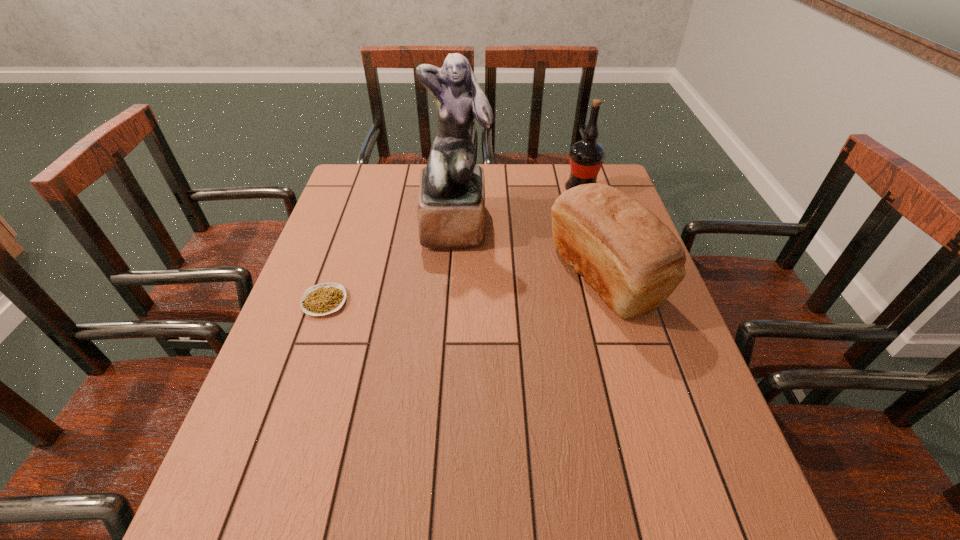
Image resolution: width=960 pixels, height=540 pixels. I want to click on vacant space at the right edge, so click(680, 485).

Locate an element on the screen. The width and height of the screenshot is (960, 540). free space at the far left corner is located at coordinates (368, 203).

The height and width of the screenshot is (540, 960). In the image, there is a desktop. Find the location of `vacant space at the near left corner`. vacant space at the near left corner is located at coordinates (250, 539).

Find the location of a particular element. The height and width of the screenshot is (540, 960). vacant space at the far right corner of the desktop is located at coordinates (605, 178).

The image size is (960, 540). I want to click on free space at the near right corner of the desktop, so click(x=698, y=501).

The width and height of the screenshot is (960, 540). What are the coordinates of `empty space that is in between the second shortest object and the legume` in the screenshot? It's located at (465, 289).

Image resolution: width=960 pixels, height=540 pixels. Identify the location of free space between the second object from left to right and the farthest object. (518, 208).

The width and height of the screenshot is (960, 540). What are the coordinates of `free space between the farthest object and the second object from left to right` in the screenshot? It's located at (518, 208).

Identify the location of vacant area that lies between the third object from right to left and the leftmost object. This screenshot has height=540, width=960. (391, 264).

You are a GUI agent. You are given a task and a screenshot of the screen. Output one action in this format:
    pyautogui.click(x=<x>, y=<y>)
    Task: Click on the free space between the bread and the leftmost object
    
    Given the screenshot: What is the action you would take?
    pyautogui.click(x=465, y=289)